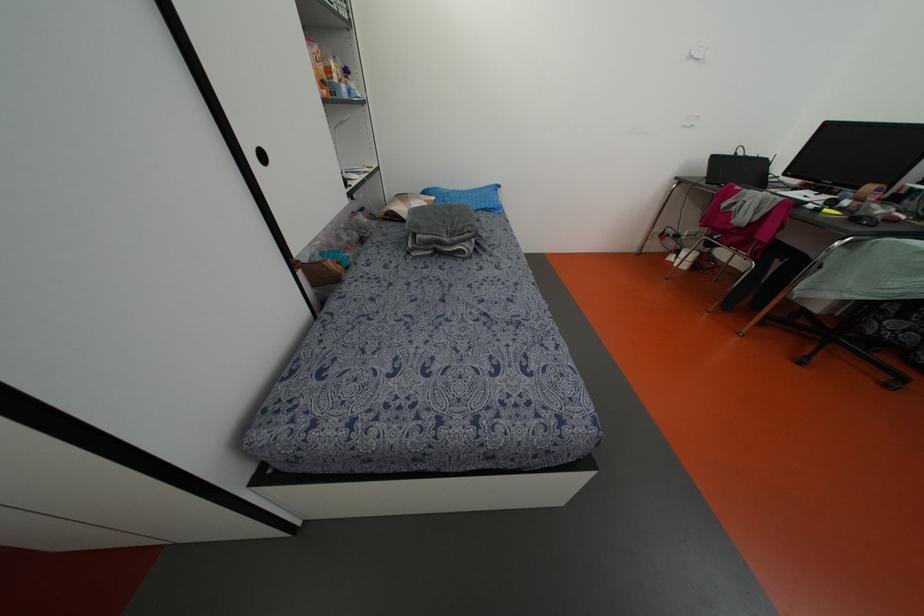
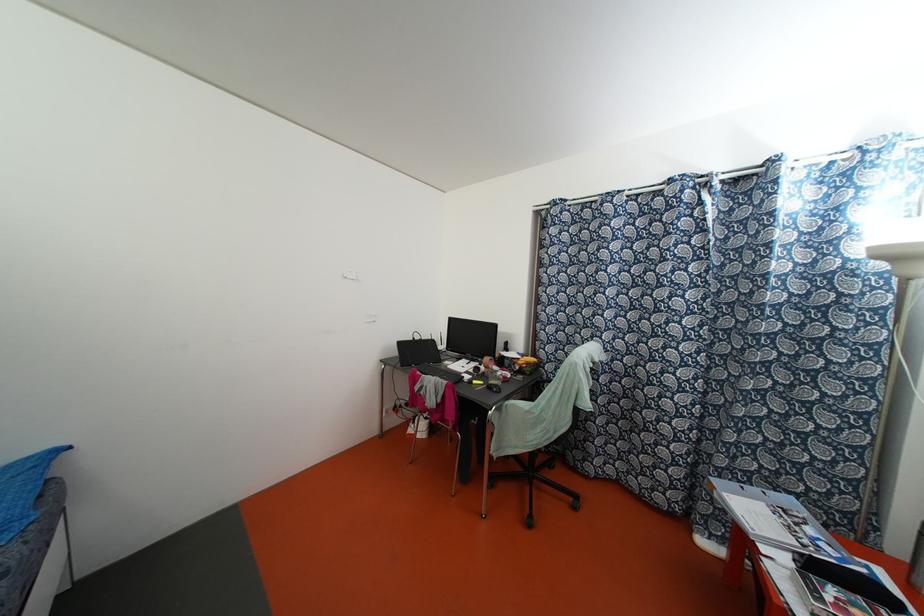
Looking at this image, the first image is from the beginning of the video and the second image is from the end. How did the camera likely rotate when shooting the video?

The camera rotated toward right-up.